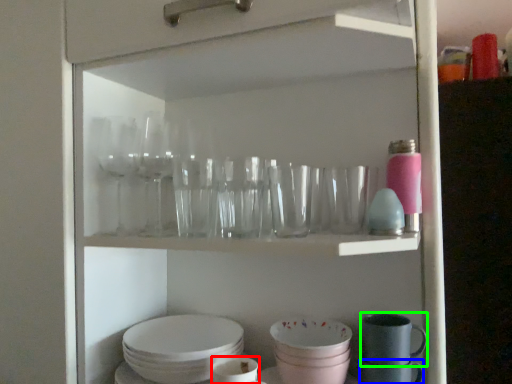
Question: Which is farther away from tableware (highlighted by a red box)? tableware (highlighted by a blue box) or tableware (highlighted by a green box)?

Choices:
 (A) tableware
 (B) tableware

Answer: (B)